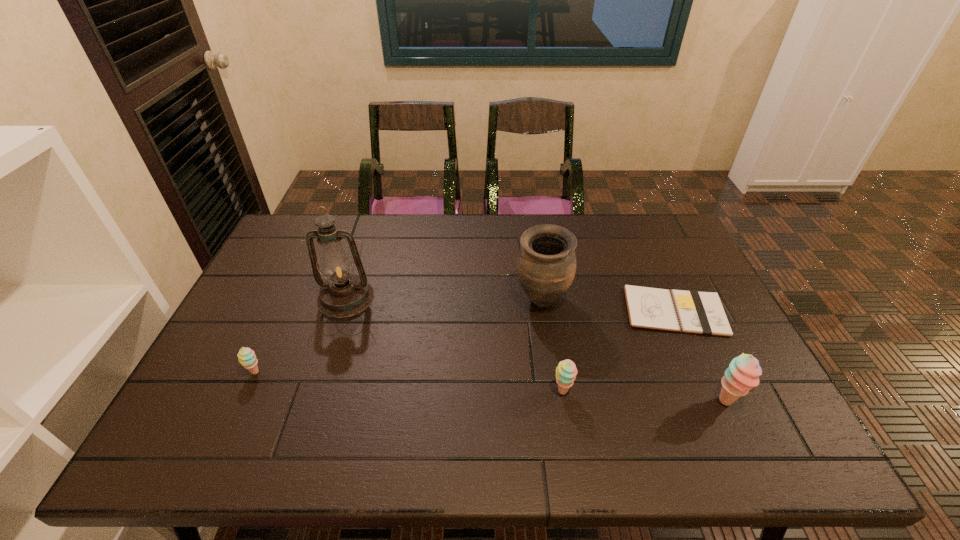
Locate an element on the screen. Image resolution: width=960 pixels, height=540 pixels. sherbert that is the closest to the shortest object is located at coordinates (743, 373).

The height and width of the screenshot is (540, 960). Find the location of `free space that satisfies the following two spatial constraints: 1. on the back side of the second tallest object; 2. on the left side of the leftmost sherbert`. free space that satisfies the following two spatial constraints: 1. on the back side of the second tallest object; 2. on the left side of the leftmost sherbert is located at coordinates click(288, 300).

This screenshot has width=960, height=540. Find the location of `vacant space that satisfies the following two spatial constraints: 1. on the back side of the shortest object; 2. on the right side of the leftmost object`. vacant space that satisfies the following two spatial constraints: 1. on the back side of the shortest object; 2. on the right side of the leftmost object is located at coordinates (283, 311).

Locate an element on the screen. The image size is (960, 540). free spot that satisfies the following two spatial constraints: 1. on the front side of the notepad; 2. on the right side of the oil lamp is located at coordinates (342, 311).

Image resolution: width=960 pixels, height=540 pixels. What are the coordinates of `vacant area in the image that satisfies the following two spatial constraints: 1. on the back side of the second shortest object; 2. on the right side of the fifth object from right to left` in the screenshot? It's located at (289, 298).